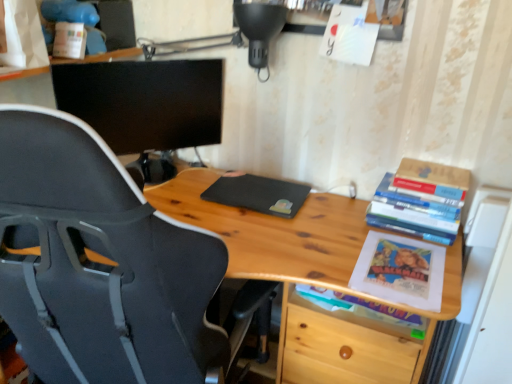
Where is `vacant space in front of hardcover books at right, which appears as the second book when ordered from the bottom`? The height and width of the screenshot is (384, 512). vacant space in front of hardcover books at right, which appears as the second book when ordered from the bottom is located at coordinates (416, 256).